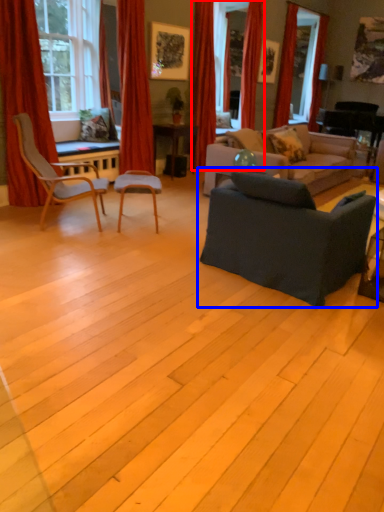
Question: Which object appears closest to the camera in this image, curtain (highlighted by a red box) or studio couch (highlighted by a blue box)?

Choices:
 (A) curtain
 (B) studio couch

Answer: (B)